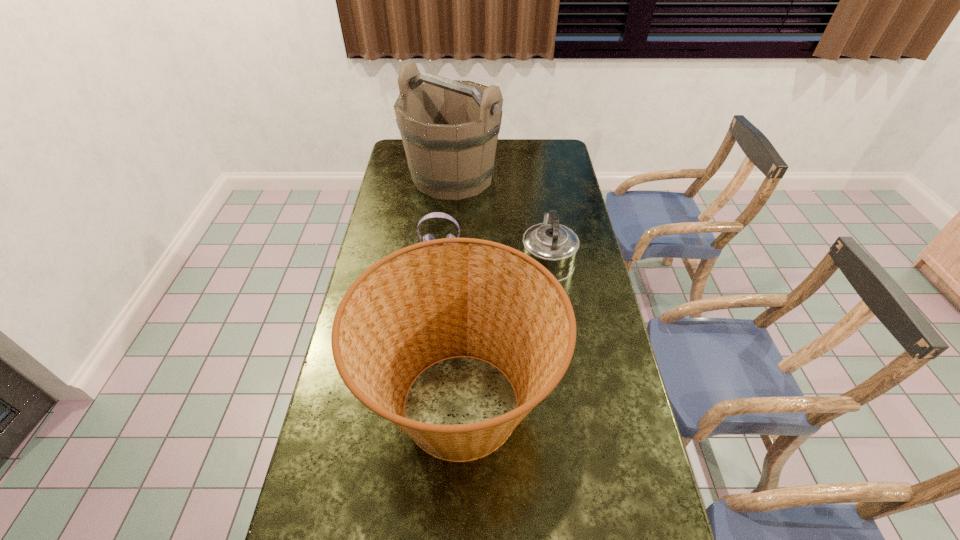
Image resolution: width=960 pixels, height=540 pixels. Identify the location of vacant region between the tallest object and the headset. (446, 213).

You are a GUI agent. You are given a task and a screenshot of the screen. Output one action in this format:
    pyautogui.click(x=<x>, y=<y>)
    Task: Click on the free point between the shortest object and the farthest object
    The image size is (960, 540).
    Given the screenshot: What is the action you would take?
    pyautogui.click(x=446, y=213)

Locate an element on the screen. The width and height of the screenshot is (960, 540). free space between the kettle and the farthest object is located at coordinates (500, 217).

Locate an element on the screen. free space between the tallest object and the shortest object is located at coordinates (446, 213).

Choose which object is the nearest neighbor to the basket. Please provide its 2D coordinates. Your answer should be formatted as a tuple, i.e. [(x, y)], where the tuple contains the x and y coordinates of a point satisfying the conditions above.

[(555, 246)]

The width and height of the screenshot is (960, 540). What are the coordinates of `object that can be found as the closest to the headset` in the screenshot? It's located at (555, 246).